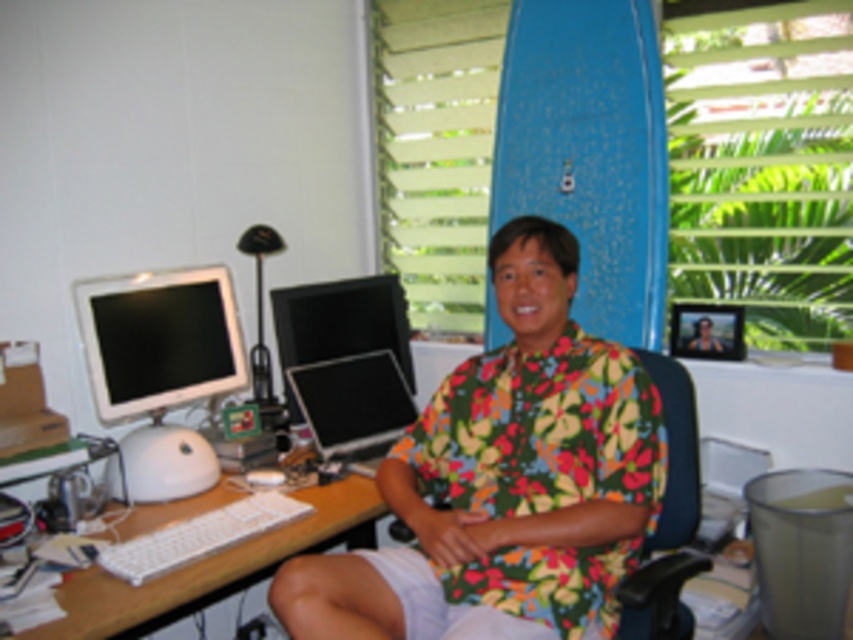
Question: Can you confirm if white glossy computer monitor at left is positioned below blue fabric swivel chair at center?

Choices:
 (A) yes
 (B) no

Answer: (B)

Question: Is blue fabric swivel chair at center to the right of black glossy monitor at center from the viewer's perspective?

Choices:
 (A) no
 (B) yes

Answer: (B)

Question: Which of the following is the farthest from the observer?

Choices:
 (A) (241, 497)
 (B) (163, 298)
 (C) (688, 385)

Answer: (B)

Question: In this image, where is floral fabric shirt at center located relative to black glossy monitor at center?

Choices:
 (A) right
 (B) left

Answer: (A)

Question: Which point is farther to the camera?

Choices:
 (A) (328, 326)
 (B) (131, 358)

Answer: (A)

Question: Which point is closer to the camera?

Choices:
 (A) blue fabric swivel chair at center
 (B) white plastic keyboard at lower left
 (C) floral fabric shirt at center
 (D) black glossy monitor at center

Answer: (C)